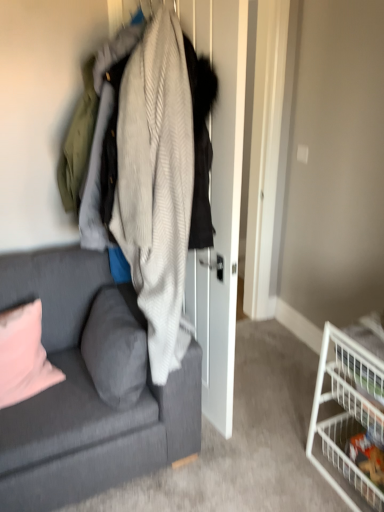
Question: Considering the relative positions of textured gray couch at left and white wire basket at lower right, the first shelf viewed from the top, in the image provided, is textured gray couch at left to the left of white wire basket at lower right, the first shelf viewed from the top, from the viewer's perspective?

Choices:
 (A) no
 (B) yes

Answer: (B)

Question: Does textured gray couch at left come in front of white wire basket at lower right, the first shelf viewed from the top?

Choices:
 (A) no
 (B) yes

Answer: (B)

Question: Considering the relative sizes of textured gray couch at left and white wire basket at lower right, the first shelf viewed from the top, in the image provided, is textured gray couch at left smaller than white wire basket at lower right, the first shelf viewed from the top,?

Choices:
 (A) no
 (B) yes

Answer: (A)

Question: Can we say textured gray couch at left lies outside white wire basket at lower right, the first shelf viewed from the top?

Choices:
 (A) yes
 (B) no

Answer: (A)

Question: Does textured gray couch at left come behind white wire basket at lower right, the first shelf viewed from the top?

Choices:
 (A) no
 (B) yes

Answer: (A)

Question: Looking at the image, does gray fabric pillow at lower left, which appears as the first pillow when viewed from the right, seem bigger or smaller compared to white wire basket at lower right, the first shelf viewed from the top?

Choices:
 (A) big
 (B) small

Answer: (B)

Question: In terms of height, does gray fabric pillow at lower left, which is the second pillow in left-to-right order, look taller or shorter compared to white wire basket at lower right, the second shelf from the bottom?

Choices:
 (A) tall
 (B) short

Answer: (B)

Question: Considering their positions, is gray fabric pillow at lower left, which appears as the first pillow when viewed from the right, located in front of or behind white wire basket at lower right, the second shelf from the bottom?

Choices:
 (A) behind
 (B) front

Answer: (A)

Question: From the image's perspective, is gray fabric pillow at lower left, which is the second pillow in left-to-right order, located above or below white wire basket at lower right, the second shelf from the bottom?

Choices:
 (A) below
 (B) above

Answer: (B)

Question: In terms of size, does white wire basket at lower right, the first shelf viewed from the top, appear bigger or smaller than pink fabric pillow at lower left, the second pillow from the right?

Choices:
 (A) big
 (B) small

Answer: (A)

Question: Is white wire basket at lower right, the second shelf from the bottom, inside the boundaries of pink fabric pillow at lower left, arranged as the 1th pillow when viewed from the left, or outside?

Choices:
 (A) inside
 (B) outside

Answer: (B)

Question: Is white wire basket at lower right, the second shelf from the bottom, taller or shorter than pink fabric pillow at lower left, the second pillow from the right?

Choices:
 (A) tall
 (B) short

Answer: (A)

Question: From the image's perspective, is white wire basket at lower right, the first shelf viewed from the top, located above or below pink fabric pillow at lower left, arranged as the 1th pillow when viewed from the left?

Choices:
 (A) above
 (B) below

Answer: (B)

Question: Do you think gray fabric pillow at lower left, which is the second pillow in left-to-right order, is within textured gray couch at left, or outside of it?

Choices:
 (A) inside
 (B) outside

Answer: (A)

Question: Is point (117, 349) positioned closer to the camera than point (82, 445)?

Choices:
 (A) closer
 (B) farther

Answer: (B)